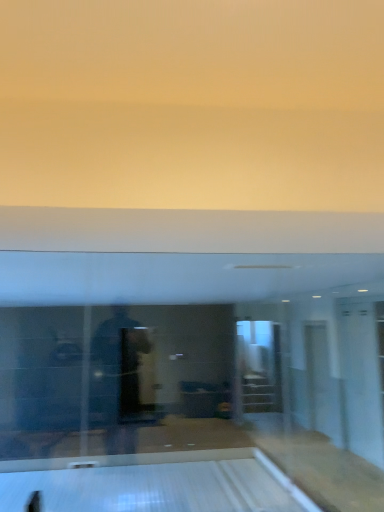
Question: Is transparent glass door at right completely or partially inside white glossy bowling alley at lower center?

Choices:
 (A) yes
 (B) no

Answer: (B)

Question: Does white glossy bowling alley at lower center appear on the right side of transparent glass door at right?

Choices:
 (A) yes
 (B) no

Answer: (B)

Question: Is white glossy bowling alley at lower center bigger than transparent glass door at right?

Choices:
 (A) yes
 (B) no

Answer: (B)

Question: Is white glossy bowling alley at lower center taller than transparent glass door at right?

Choices:
 (A) no
 (B) yes

Answer: (A)

Question: From the image's perspective, is white glossy bowling alley at lower center below transparent glass door at right?

Choices:
 (A) no
 (B) yes

Answer: (B)

Question: Can we say white glossy bowling alley at lower center lies outside transparent glass door at right?

Choices:
 (A) yes
 (B) no

Answer: (A)

Question: Can we say transparent glass door at right lies outside white glossy bowling alley at lower center?

Choices:
 (A) no
 (B) yes

Answer: (B)

Question: Considering the relative positions of transparent glass door at right and white glossy bowling alley at lower center in the image provided, is transparent glass door at right to the right of white glossy bowling alley at lower center from the viewer's perspective?

Choices:
 (A) no
 (B) yes

Answer: (B)

Question: Is white glossy bowling alley at lower center surrounded by transparent glass door at right?

Choices:
 (A) no
 (B) yes

Answer: (A)

Question: Is transparent glass door at right facing towards white glossy bowling alley at lower center?

Choices:
 (A) no
 (B) yes

Answer: (B)

Question: Is transparent glass door at right bigger than white glossy bowling alley at lower center?

Choices:
 (A) no
 (B) yes

Answer: (B)

Question: Are transparent glass door at right and white glossy bowling alley at lower center located far from each other?

Choices:
 (A) yes
 (B) no

Answer: (A)

Question: Looking at the image, does white glossy bowling alley at lower center seem bigger or smaller compared to transparent glass door at right?

Choices:
 (A) small
 (B) big

Answer: (A)